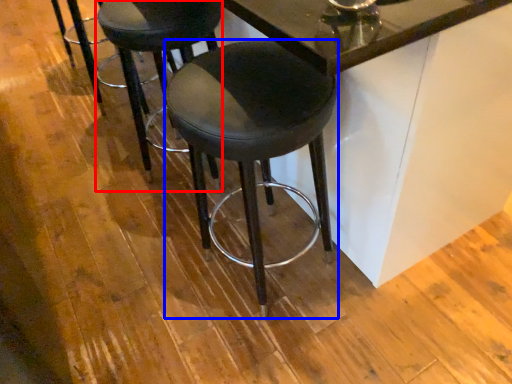
Question: Which of the following is the closest to the observer, stool (highlighted by a red box) or stool (highlighted by a blue box)?

Choices:
 (A) stool
 (B) stool

Answer: (B)